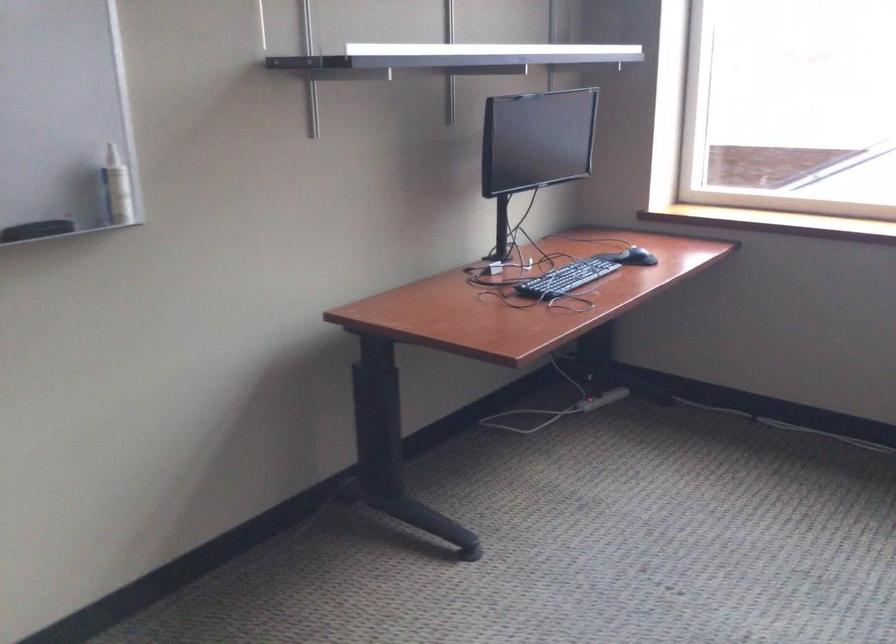
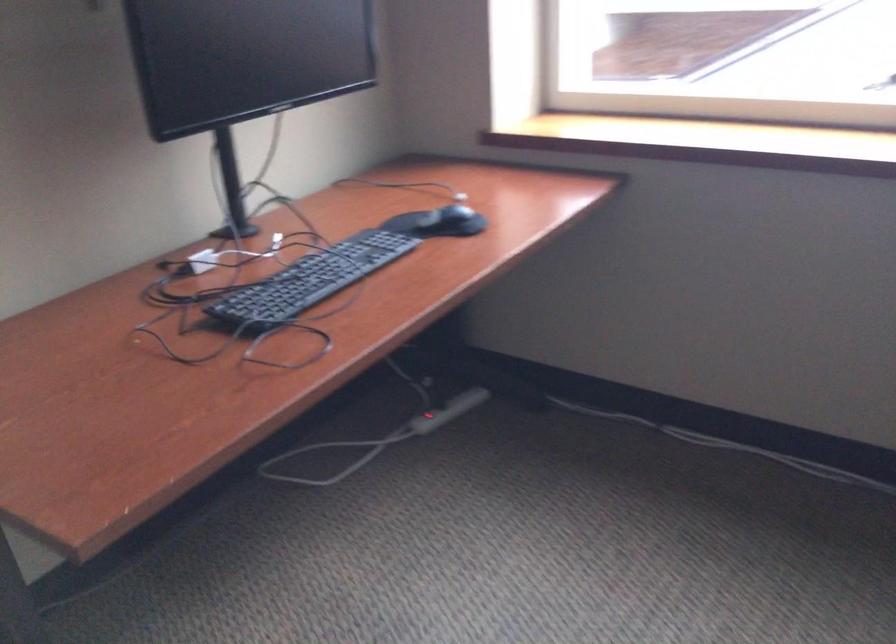
Locate, in the second image, the point that corresponds to [595,402] in the first image.

(428, 421)